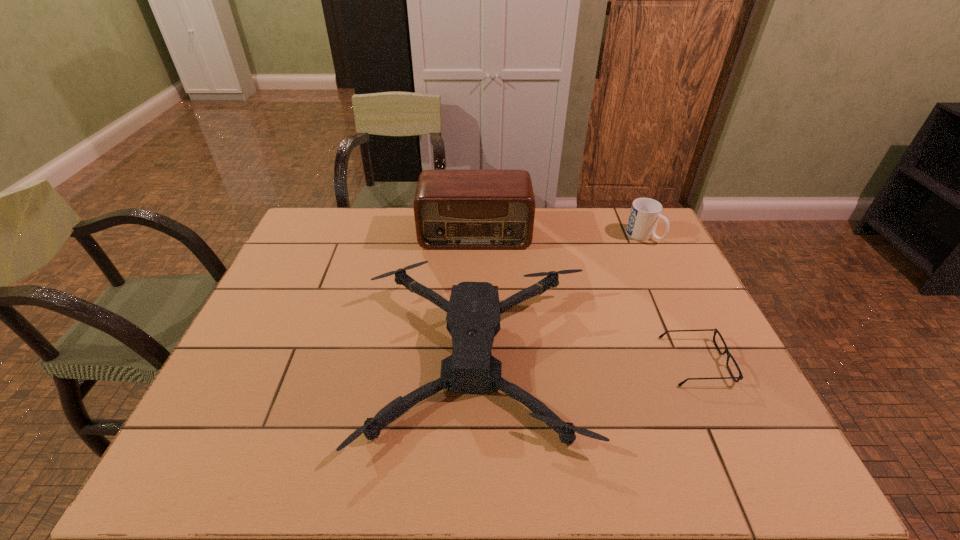
This screenshot has width=960, height=540. I want to click on radio receiver, so click(453, 209).

This screenshot has width=960, height=540. Find the location of `mug`. mug is located at coordinates (645, 212).

At what (x,y) coordinates should I click in order to perform the action: click on the third tallest object. Please return your answer as a coordinate pair (x, y). The image size is (960, 540). Looking at the image, I should click on tap(473, 318).

Where is `spectacles`? This screenshot has width=960, height=540. spectacles is located at coordinates (715, 330).

Locate an element on the screen. The height and width of the screenshot is (540, 960). free space located on the front panel of the radio receiver is located at coordinates (474, 272).

I want to click on vacant space located on the front of the mug, so click(687, 327).

Where is `vacant space located on the left of the drone`? This screenshot has height=540, width=960. vacant space located on the left of the drone is located at coordinates (282, 358).

I want to click on radio receiver located in the far edge section of the desktop, so click(453, 209).

The height and width of the screenshot is (540, 960). I want to click on mug at the far edge, so click(645, 212).

Image resolution: width=960 pixels, height=540 pixels. What are the coordinates of `object present at the near edge` in the screenshot? It's located at (473, 318).